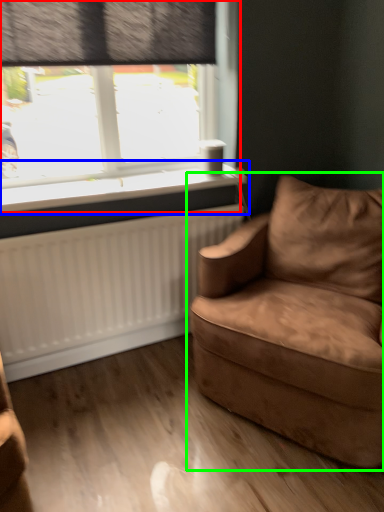
Question: Which is nearer to the window (highlighted by a red box)? window sill (highlighted by a blue box) or studio couch (highlighted by a green box).

Choices:
 (A) window sill
 (B) studio couch

Answer: (A)